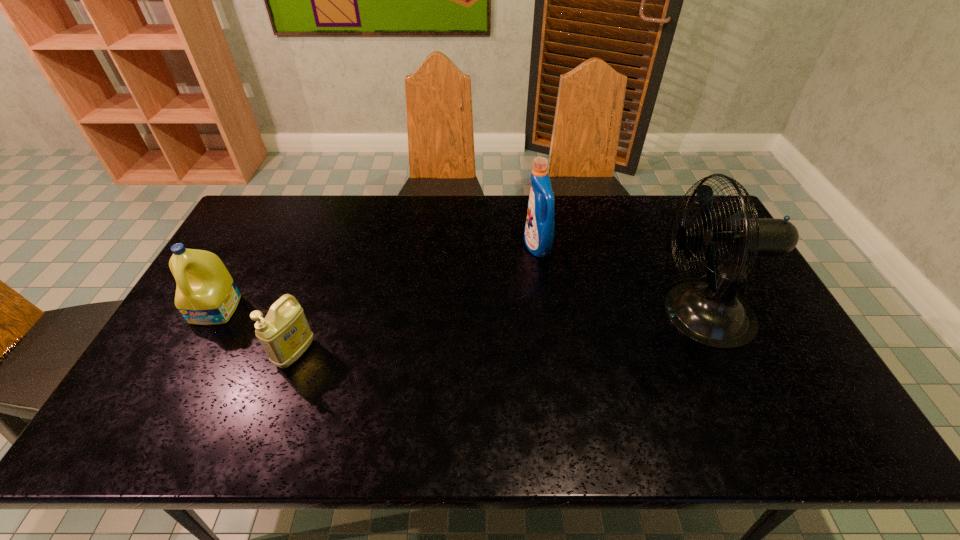
Find the location of a particular element. This screenshot has height=540, width=960. fan is located at coordinates point(711,313).

Locate an element on the screen. the tallest object is located at coordinates (711, 313).

The width and height of the screenshot is (960, 540). In order to click on the tallest detergent in this screenshot , I will do `click(539, 230)`.

At what (x,y) coordinates should I click in order to perform the action: click on the rightmost detergent. Please return your answer as a coordinate pair (x, y). This screenshot has height=540, width=960. Looking at the image, I should click on (539, 230).

The height and width of the screenshot is (540, 960). I want to click on the leftmost object, so click(206, 294).

I want to click on the leftmost detergent, so click(206, 294).

You are a GUI agent. You are given a task and a screenshot of the screen. Output one action in this format:
    pyautogui.click(x=<x>, y=<y>)
    Task: Click on the shortest object
    This screenshot has height=540, width=960.
    Given the screenshot: What is the action you would take?
    pyautogui.click(x=284, y=333)

Where is `the shortest detergent`? The image size is (960, 540). the shortest detergent is located at coordinates (284, 333).

Find the location of a particular element. free space located 0.240m on the front-facing side of the tallest object is located at coordinates (566, 314).

Locate an element on the screen. This screenshot has width=960, height=540. vacant region located on the front-facing side of the tallest object is located at coordinates (548, 314).